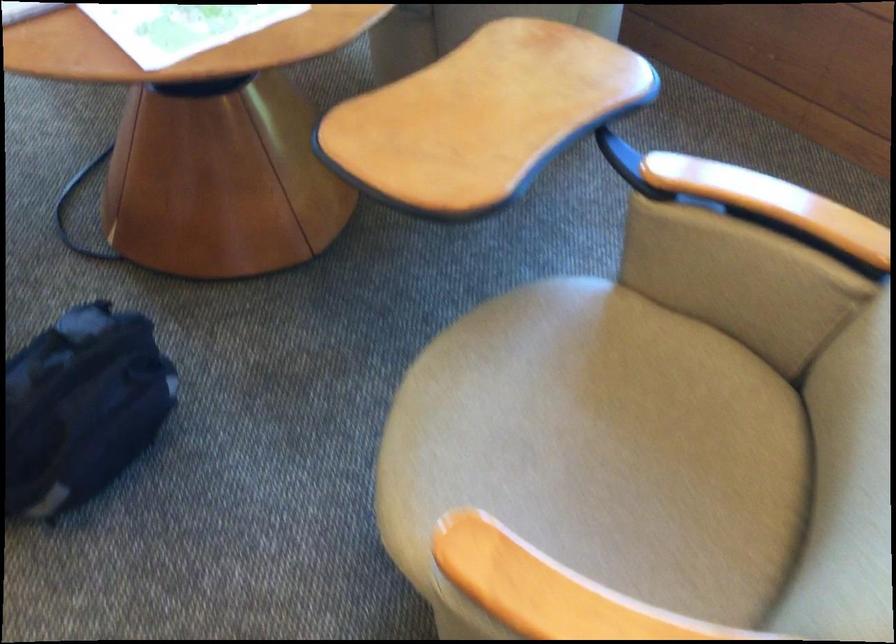
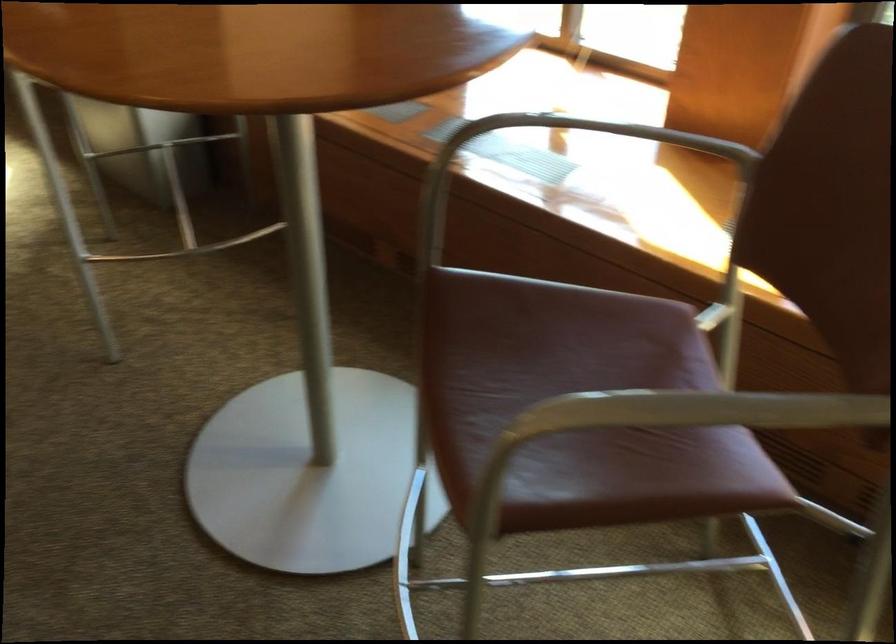
The images are taken continuously from a first-person perspective. In which direction are you moving?

The cameraman moved toward left, forward.